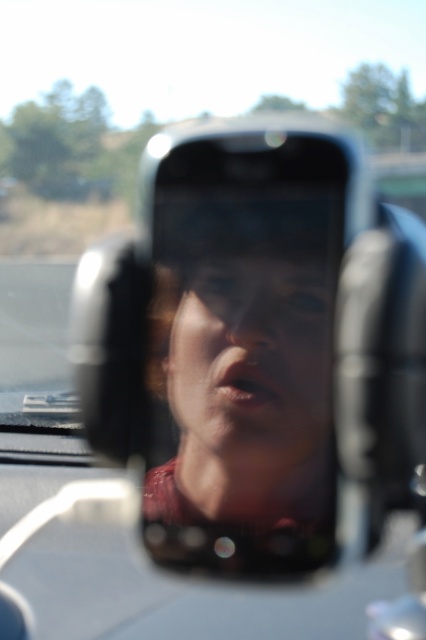
Question: Among these points, which one is farthest from the camera?

Choices:
 (A) (184, 417)
 (B) (173, 525)

Answer: (A)

Question: Is matte black phone at center to the left of smooth skin face at center from the viewer's perspective?

Choices:
 (A) yes
 (B) no

Answer: (A)

Question: Is matte black phone at center closer to the viewer compared to smooth skin face at center?

Choices:
 (A) no
 (B) yes

Answer: (B)

Question: Among these points, which one is farthest from the camera?

Choices:
 (A) (327, 432)
 (B) (291, 324)

Answer: (B)

Question: Which object appears farthest from the camera in this image?

Choices:
 (A) matte black phone at center
 (B) smooth skin face at center

Answer: (B)

Question: Is matte black phone at center smaller than smooth skin face at center?

Choices:
 (A) no
 (B) yes

Answer: (A)